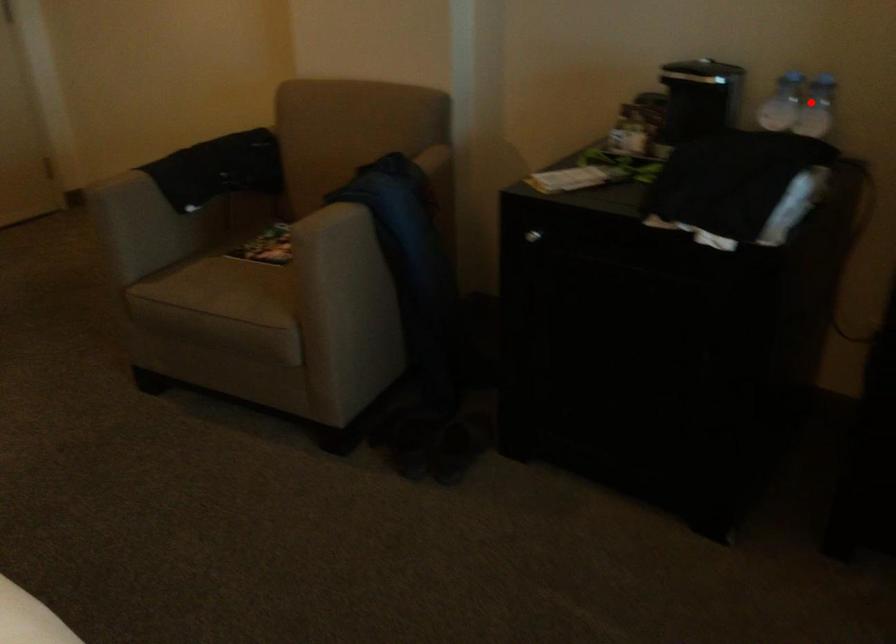
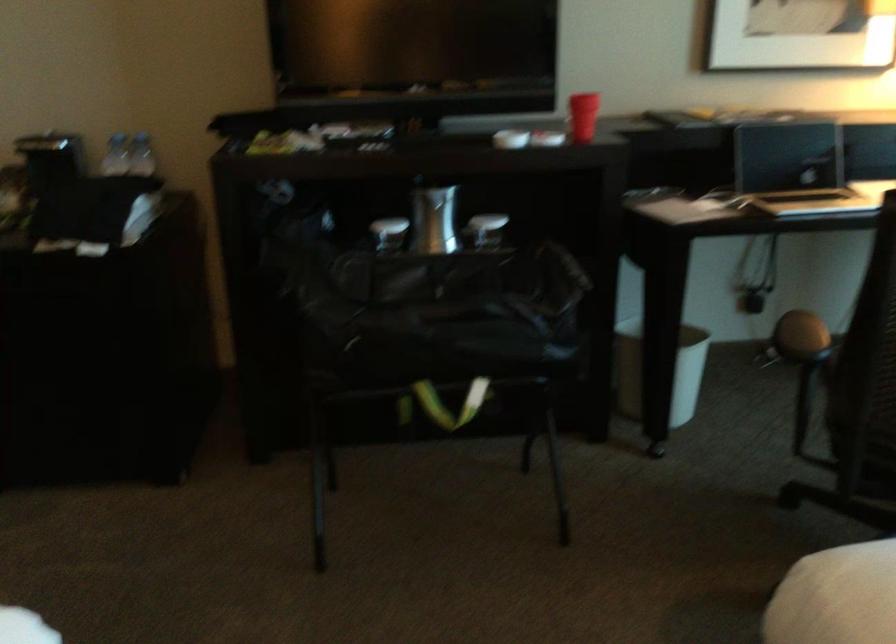
Where in the second image is the point corresponding to the highlighted location from the first image?

(141, 155)